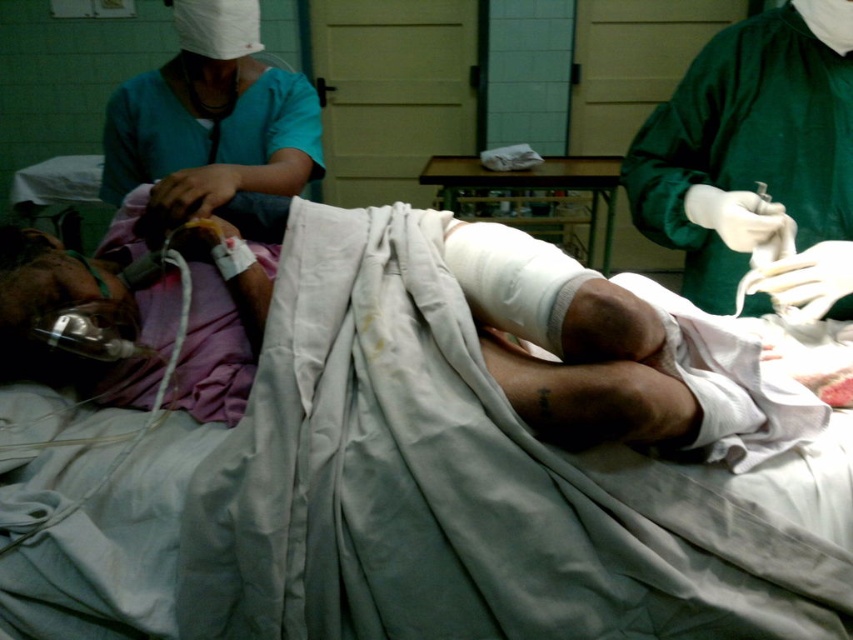
You are a medical professional in the room. You need to move a medical chart from the counter to the patient bed. The chart is currently at point [775,186]. Can you reach it without moving more than 1.5 meters from your current position?

The distance between point [775,186] and the camera is 1.35 meters. Since 1.35 meters is less than 1.5 meters, you can reach the chart without moving more than 1.5 meters from your current position.

You are a medical student observing a patient care scenario. You notice two medical staff members wearing different colored uniforms. The first is wearing a teal fabric uniform at upper left, and the second is wearing a green smooth surgical gown at right. Based on their positions relative to each other, which staff member is closer to the patient?

The green smooth surgical gown at right is closer to the patient because it is positioned below the teal fabric uniform at upper left, indicating it is lower in the scene and therefore nearer to the patient lying on the bed.